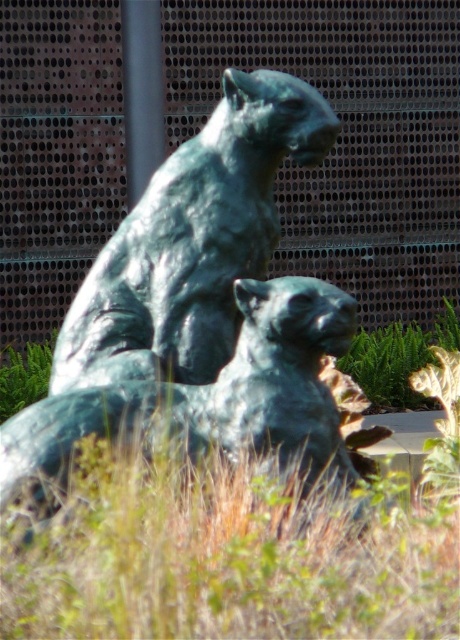
Is point (213, 237) positioned before point (154, 61)?

Yes, point (213, 237) is closer to viewer.

Does green patina statue at center appear over metallic pole at upper center?

No, green patina statue at center is not above metallic pole at upper center.

What are the coordinates of `green patina statue at center` in the screenshot? It's located at tap(176, 282).

Which is behind, point (160, 467) or point (139, 134)?

The point (139, 134) is more distant.

Does green grass at lower center appear on the left side of metallic pole at upper center?

Incorrect, green grass at lower center is not on the left side of metallic pole at upper center.

Between point (410, 577) and point (155, 61), which one is positioned in front?

Point (410, 577)

Find the location of a particular element. green grass at lower center is located at coordinates (228, 557).

Is point (191, 236) farther from camera compared to point (348, 577)?

Yes, point (191, 236) is farther from viewer.

Is green patina statue at center thinner than green grass at lower center?

Yes, green patina statue at center is thinner than green grass at lower center.

Is point (120, 289) in front of point (223, 532)?

No, (120, 289) is further to viewer.

The image size is (460, 640). I want to click on green patina statue at center, so click(176, 282).